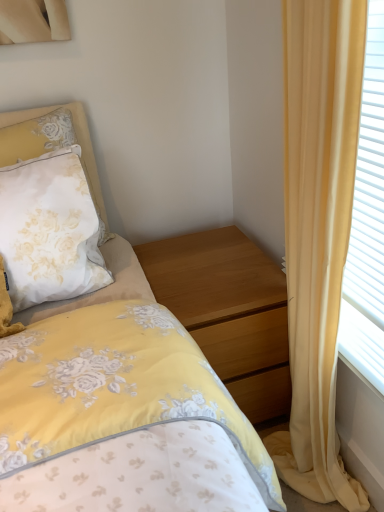
Question: From the image's perspective, is wooden nightstand at center located above or below yellow fabric curtain at right?

Choices:
 (A) below
 (B) above

Answer: (A)

Question: Considering the positions of wooden nightstand at center and yellow fabric curtain at right in the image, is wooden nightstand at center taller or shorter than yellow fabric curtain at right?

Choices:
 (A) short
 (B) tall

Answer: (A)

Question: Which object is the closest to the wooden nightstand at center?

Choices:
 (A) yellow fabric curtain at right
 (B) white satin pillow at upper left

Answer: (A)

Question: Which object is positioned farthest from the white satin pillow at upper left?

Choices:
 (A) wooden nightstand at center
 (B) yellow fabric curtain at right

Answer: (B)